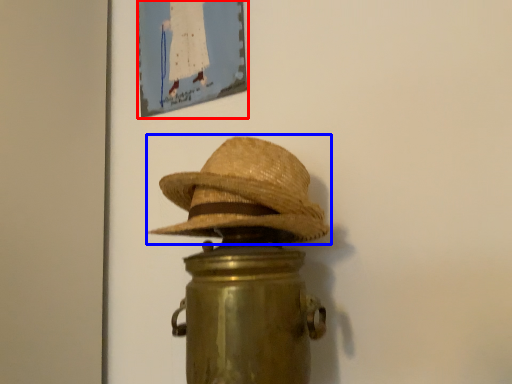
Question: Which object is further to the camera taking this photo, picture frame (highlighted by a red box) or cowboy hat (highlighted by a blue box)?

Choices:
 (A) picture frame
 (B) cowboy hat

Answer: (A)